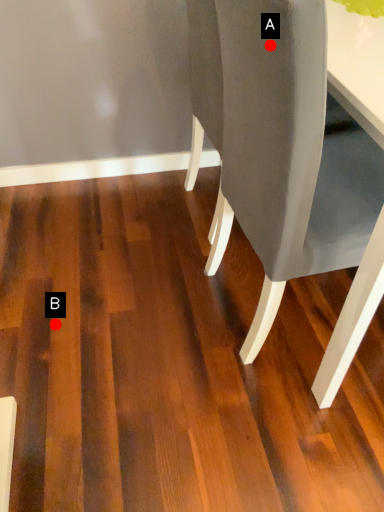
Question: Two points are circled on the image, labeled by A and B beside each circle. Which of the following is the farthest from the observer?

Choices:
 (A) A is further
 (B) B is further

Answer: (B)